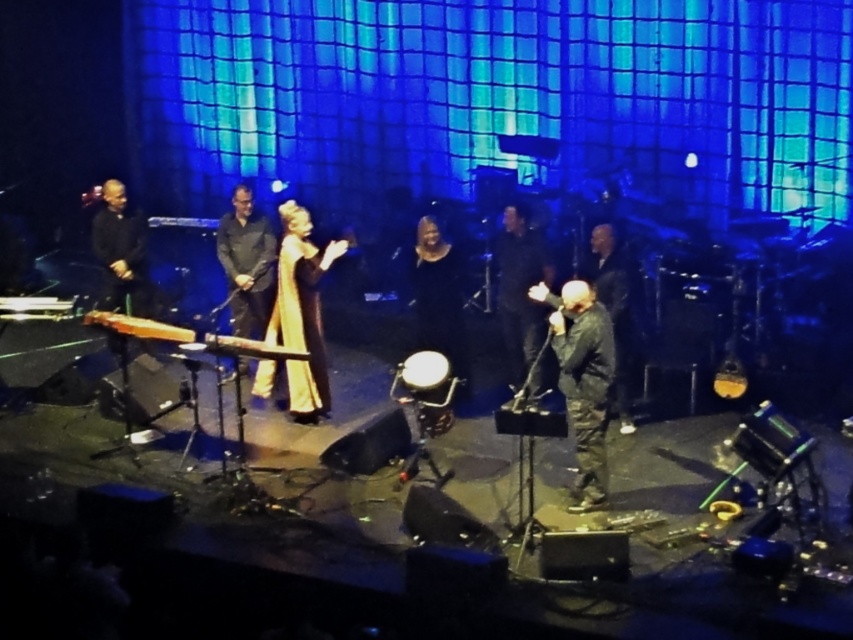
Question: Is black velvet dress at center positioned at the back of camouflage jacket at center?

Choices:
 (A) yes
 (B) no

Answer: (A)

Question: Does gold silk dress at center appear over black matte shirt at center?

Choices:
 (A) no
 (B) yes

Answer: (A)

Question: Which of the following is the closest to the observer?

Choices:
 (A) gold silk dress at center
 (B) black velvet dress at center
 (C) black matte shirt at center
 (D) black matte suit at center

Answer: (A)

Question: Is black matte suit at left below wooden/carved harp at center?

Choices:
 (A) no
 (B) yes

Answer: (A)

Question: Which point is farther to the camera?

Choices:
 (A) gold silk dress at center
 (B) wooden/carved harp at center

Answer: (A)

Question: Which point is farther from the camera taking this photo?

Choices:
 (A) (601, 273)
 (B) (277, 353)

Answer: (A)